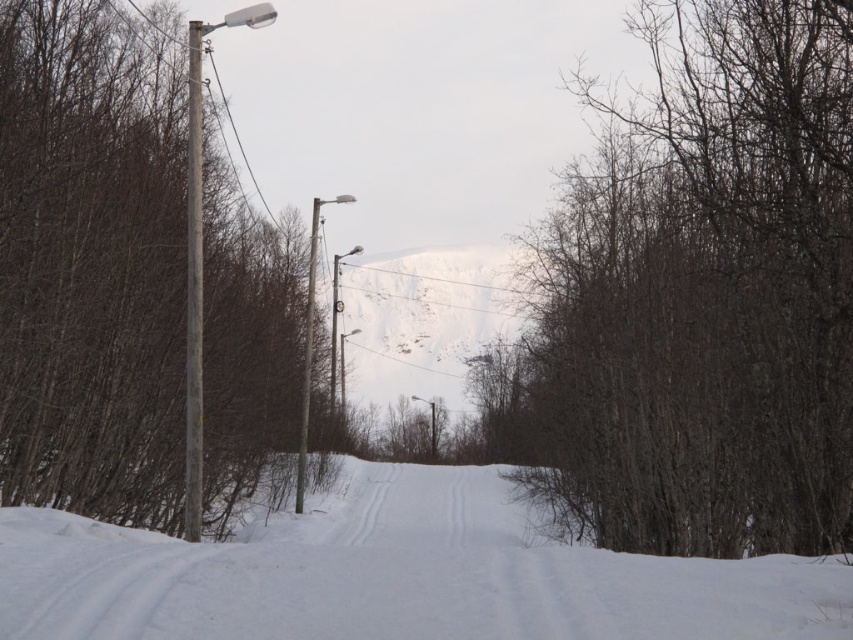
Question: Among these objects, which one is nearest to the camera?

Choices:
 (A) smooth brown pole at left
 (B) white powdery snow at center

Answer: (B)

Question: Which of the following is the farthest from the observer?

Choices:
 (A) (300, 509)
 (B) (809, 454)
 (C) (201, 243)

Answer: (A)

Question: Does brown/dry wood at center have a smaller size compared to smooth gray pole at left?

Choices:
 (A) yes
 (B) no

Answer: (B)

Question: Is the position of white powdery snow at center less distant than that of wooden pole at left?

Choices:
 (A) no
 (B) yes

Answer: (B)

Question: Does smooth brown pole at left appear under white powdery snow at center?

Choices:
 (A) no
 (B) yes

Answer: (A)

Question: Which of the following is the farthest from the observer?

Choices:
 (A) wooden pole at left
 (B) smooth gray pole at left
 (C) smooth brown pole at left
 (D) white powdery snow at center

Answer: (A)